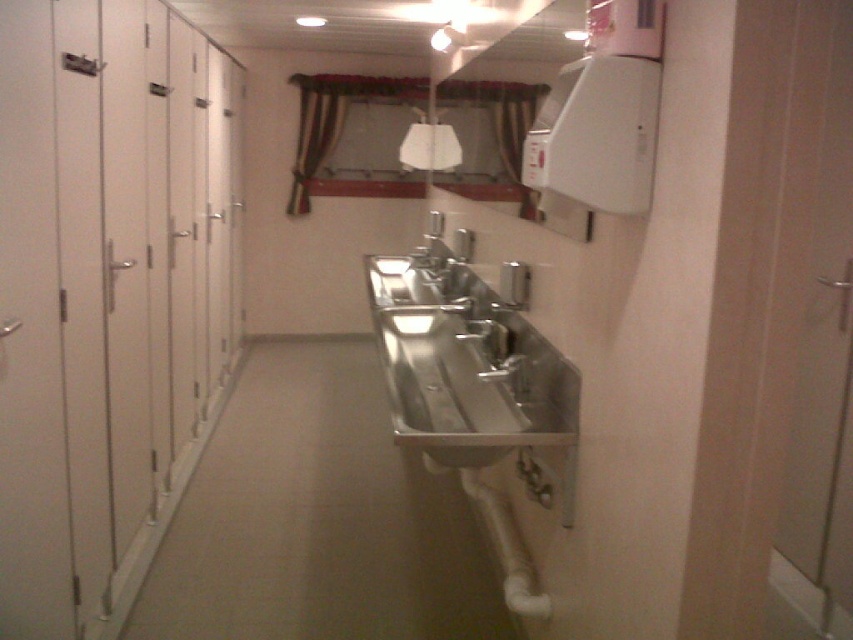
From the picture: How much distance is there between white matte lockers at left and stainless steel sink at center?

They are 1.02 meters apart.

From the picture: Is white matte lockers at left below stainless steel sink at center?

Actually, white matte lockers at left is above stainless steel sink at center.

Between point (135, 300) and point (503, 445), which one is positioned behind?

The point (135, 300) is behind.

This screenshot has width=853, height=640. What are the coordinates of `white matte lockers at left` in the screenshot? It's located at (107, 296).

Is point (57, 314) positioned in front of point (466, 324)?

Yes.

Which is more to the left, white matte lockers at left or satin silver faucet at center?

From the viewer's perspective, white matte lockers at left appears more on the left side.

I want to click on white matte lockers at left, so click(x=107, y=296).

Who is shorter, stainless steel sink at center or satin silver faucet at center?

With less height is satin silver faucet at center.

Between stainless steel sink at center and satin silver faucet at center, which one appears on the right side from the viewer's perspective?

From the viewer's perspective, satin silver faucet at center appears more on the right side.

Between point (456, 387) and point (508, 349), which one is positioned behind?

The point (508, 349) is behind.

Where is `stainless steel sink at center`? stainless steel sink at center is located at coordinates (465, 364).